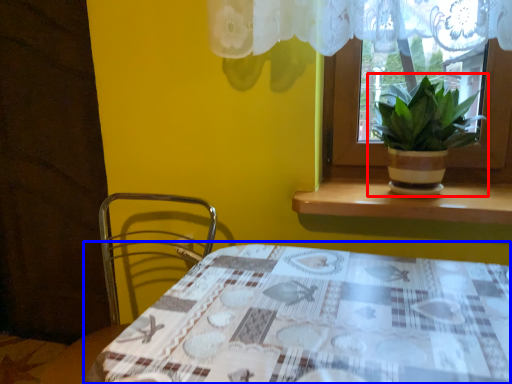
Question: Among these objects, which one is farthest to the camera, houseplant (highlighted by a red box) or table (highlighted by a blue box)?

Choices:
 (A) houseplant
 (B) table

Answer: (A)